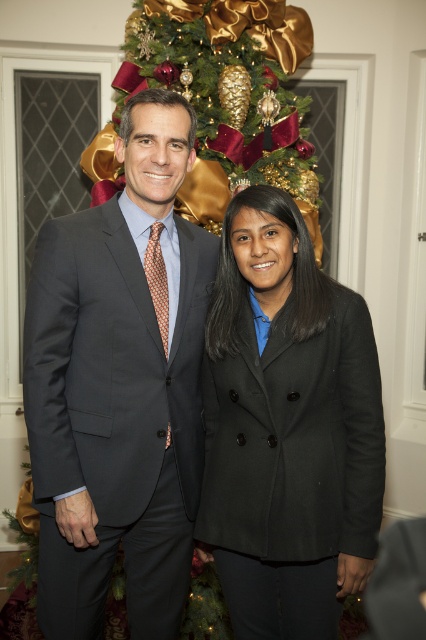
Between black wool coat at center and green textured christmas tree at upper center, which one has less height?

Answer: green textured christmas tree at upper center is shorter.

Does black wool coat at center appear on the left side of green textured christmas tree at upper center?

Incorrect, black wool coat at center is not on the left side of green textured christmas tree at upper center.

Between point (267, 348) and point (189, 33), which one is positioned behind?

Point (189, 33)

The image size is (426, 640). I want to click on black wool coat at center, so click(287, 428).

Does matte gray suit at center appear on the left side of black wool coat at center?

Yes, matte gray suit at center is to the left of black wool coat at center.

Is matte gray suit at center bigger than black wool coat at center?

Yes.

What do you see at coordinates (120, 387) in the screenshot? Image resolution: width=426 pixels, height=640 pixels. I see `matte gray suit at center` at bounding box center [120, 387].

The image size is (426, 640). Find the location of `matte gray suit at center`. matte gray suit at center is located at coordinates (120, 387).

Can you confirm if matte gray suit at center is positioned above green textured christmas tree at upper center?

Actually, matte gray suit at center is below green textured christmas tree at upper center.

Is matte gray suit at center taller than green textured christmas tree at upper center?

Yes, matte gray suit at center is taller than green textured christmas tree at upper center.

Which is behind, point (189, 547) or point (192, 88)?

Point (192, 88)

This screenshot has height=640, width=426. In order to click on matte gray suit at center in this screenshot , I will do `click(120, 387)`.